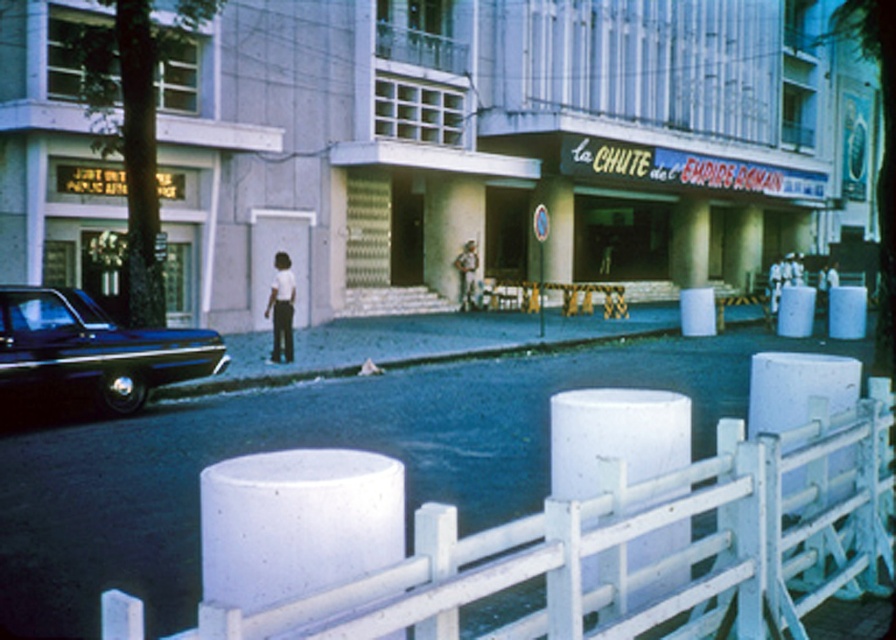
Question: Which point is farther to the camera?

Choices:
 (A) (472, 253)
 (B) (281, 314)
 (C) (207, 602)
 (D) (23, 364)

Answer: (A)

Question: From the image, what is the correct spatial relationship of white concrete fence at lower center in relation to white matte pants at center?

Choices:
 (A) below
 (B) above

Answer: (A)

Question: Which point is closer to the camera taking this photo?

Choices:
 (A) (823, 536)
 (B) (182, 365)
 (C) (472, 305)
 (D) (279, 273)

Answer: (A)

Question: Is matte concrete storefront at center positioned before white concrete fence at lower center?

Choices:
 (A) yes
 (B) no

Answer: (B)

Question: Considering the relative positions of white matte pants at center and camouflage fabric uniform at center in the image provided, where is white matte pants at center located with respect to camouflage fabric uniform at center?

Choices:
 (A) right
 (B) left

Answer: (B)

Question: Which point is farther to the camera?

Choices:
 (A) (72, 324)
 (B) (441, 131)
 (C) (474, 252)

Answer: (C)